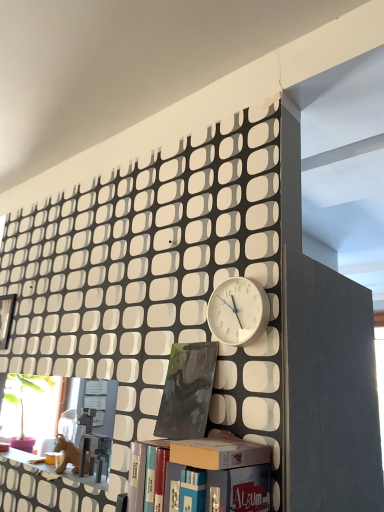
What do you see at coordinates (219, 452) in the screenshot?
I see `matte cardboard box at center` at bounding box center [219, 452].

Measure the distance between hardcover book at center, the first book viewed from the front, and camera.

The distance of hardcover book at center, the first book viewed from the front, from camera is 36.34 inches.

Find the location of a particular element. The image size is (384, 512). white matte clock at center is located at coordinates (238, 312).

Locate an element on the screen. bookcase on the left of the dark green matte painting at center, the first book in the back-to-front sequence is located at coordinates (156, 281).

From a real-world perspective, is dark green matte painting at center, the first book in the back-to-front sequence, above or below matte black bookcase at lower center?

From a real-world perspective, dark green matte painting at center, the first book in the back-to-front sequence, is physically below matte black bookcase at lower center.

Considering the sizes of objects dark green matte painting at center, the first book in the back-to-front sequence, and matte black bookcase at lower center in the image provided, who is taller, dark green matte painting at center, the first book in the back-to-front sequence, or matte black bookcase at lower center?

With more height is matte black bookcase at lower center.

Is point (197, 393) farther from viewer compared to point (263, 337)?

Yes, it is.

Between hardcover book at center, the first book viewed from the front, and white matte clock at center, which one has larger width?

Wider between the two is hardcover book at center, the first book viewed from the front.

Would you say hardcover book at center, the first book viewed from the front, is inside or outside white matte clock at center?

hardcover book at center, the first book viewed from the front, is not inside white matte clock at center, it's outside.

Is hardcover book at center, the 2th book when ordered from back to front, far from white matte clock at center?

No, hardcover book at center, the 2th book when ordered from back to front, is in close proximity to white matte clock at center.

Between hardcover book at center, the first book viewed from the front, and white matte clock at center, which one has smaller size?

Smaller between the two is white matte clock at center.

Consider the image. Is matte plastic shelf at lower left turned away from white matte clock at center?

matte plastic shelf at lower left does not have its back to white matte clock at center.

Can you confirm if matte plastic shelf at lower left is positioned to the right of white matte clock at center?

In fact, matte plastic shelf at lower left is to the left of white matte clock at center.

From the image's perspective, relative to white matte clock at center, is matte plastic shelf at lower left above or below?

matte plastic shelf at lower left is situated lower than white matte clock at center in the image.

Considering the relative sizes of matte plastic shelf at lower left and white matte clock at center in the image provided, is matte plastic shelf at lower left smaller than white matte clock at center?

No, matte plastic shelf at lower left is not smaller than white matte clock at center.

This screenshot has width=384, height=512. I want to click on bookcase behind the hardcover book at center, the 2th book when ordered from back to front, so click(156, 281).

Is hardcover book at center, the first book viewed from the front, next to matte black bookcase at lower center and touching it?

No, hardcover book at center, the first book viewed from the front, is not in contact with matte black bookcase at lower center.

Does hardcover book at center, the 2th book when ordered from back to front, turn towards matte black bookcase at lower center?

No.

Can you tell me how much hardcover book at center, the 2th book when ordered from back to front, and matte black bookcase at lower center differ in facing direction?

180 degrees.

Between dark green matte painting at center, the 2th book positioned from the front, and white matte clock at center, which one has larger size?

With larger size is white matte clock at center.

From the image's perspective, between dark green matte painting at center, the first book in the back-to-front sequence, and white matte clock at center, which one is located above?

white matte clock at center appears higher in the image.

From a real-world perspective, is dark green matte painting at center, the 2th book positioned from the front, beneath white matte clock at center?

Yes, from a real-world perspective, dark green matte painting at center, the 2th book positioned from the front, is beneath white matte clock at center.

In the image, is dark green matte painting at center, the first book in the back-to-front sequence, positioned in front of or behind white matte clock at center?

dark green matte painting at center, the first book in the back-to-front sequence, is positioned farther from the viewer than white matte clock at center.

From the image's perspective, is matte cardboard box at center located beneath matte black bookcase at lower center?

Indeed, from the image's perspective, matte cardboard box at center is shown beneath matte black bookcase at lower center.

Is matte cardboard box at center oriented away from matte black bookcase at lower center?

Yes, matte black bookcase at lower center is at the back of matte cardboard box at center.

Which point is more forward, (x=232, y=443) or (x=216, y=138)?

The point (x=232, y=443) is in front.

From a real-world perspective, which is physically below, matte cardboard box at center or matte black bookcase at lower center?

From a 3D spatial view, matte cardboard box at center is below.

Which object is wider, hardcover book at center, the 2th book when ordered from back to front, or matte cardboard box at center?

Wider between the two is matte cardboard box at center.

Is hardcover book at center, the first book viewed from the front, aimed at matte cardboard box at center?

No, hardcover book at center, the first book viewed from the front, is not aimed at matte cardboard box at center.

Is hardcover book at center, the 2th book when ordered from back to front, not close to matte cardboard box at center?

hardcover book at center, the 2th book when ordered from back to front, is actually quite close to matte cardboard box at center.

Is hardcover book at center, the 2th book when ordered from back to front, in front of or behind matte cardboard box at center in the image?

Clearly, hardcover book at center, the 2th book when ordered from back to front, is in front of matte cardboard box at center.

Find the location of a particular element. bookcase located in front of the dark green matte painting at center, the 2th book positioned from the front is located at coordinates (156, 281).

You are a GUI agent. You are given a task and a screenshot of the screen. Output one action in this format:
    pyautogui.click(x=<x>, y=<y>)
    Task: Click on the clock above the hardcover book at center, the first book viewed from the front (from the image's perspective)
    The height and width of the screenshot is (512, 384).
    Given the screenshot: What is the action you would take?
    pyautogui.click(x=238, y=312)

Based on their spatial positions, is matte cardboard box at center or white matte clock at center further from dark green matte painting at center, the 2th book positioned from the front?

Based on the image, matte cardboard box at center appears to be further to dark green matte painting at center, the 2th book positioned from the front.

Which object lies nearer to the anchor point matte black bookcase at lower center, matte plastic shelf at lower left or matte cardboard box at center?

Among the two, matte plastic shelf at lower left is located nearer to matte black bookcase at lower center.

Looking at the image, which one is located closer to hardcover book at center, the 2th book when ordered from back to front, matte plastic shelf at lower left or white matte clock at center?

white matte clock at center is positioned closer to the anchor hardcover book at center, the 2th book when ordered from back to front.

From the picture: Based on their spatial positions, is hardcover book at center, the first book viewed from the front, or matte cardboard box at center closer to matte plastic shelf at lower left?

hardcover book at center, the first book viewed from the front, is closer to matte plastic shelf at lower left.

From the image, which object appears to be farther from dark green matte painting at center, the first book in the back-to-front sequence, matte black bookcase at lower center or matte plastic shelf at lower left?

matte plastic shelf at lower left.

From the picture: Which object lies further to the anchor point white matte clock at center, hardcover book at center, the 2th book when ordered from back to front, or dark green matte painting at center, the first book in the back-to-front sequence?

hardcover book at center, the 2th book when ordered from back to front, lies further to white matte clock at center than the other object.

From the image, which object appears to be nearer to matte black bookcase at lower center, matte plastic shelf at lower left or hardcover book at center, the first book viewed from the front?

hardcover book at center, the first book viewed from the front, lies closer to matte black bookcase at lower center than the other object.

When comparing their distances from hardcover book at center, the first book viewed from the front, does matte plastic shelf at lower left or matte black bookcase at lower center seem closer?

matte black bookcase at lower center lies closer to hardcover book at center, the first book viewed from the front, than the other object.

Locate an element on the screen. The width and height of the screenshot is (384, 512). book situated between matte plastic shelf at lower left and hardcover book at center, the first book viewed from the front, from left to right is located at coordinates (187, 391).

You are a GUI agent. You are given a task and a screenshot of the screen. Output one action in this format:
    pyautogui.click(x=<x>, y=<y>)
    Task: Click on the book located between matte black bookcase at lower center and hardcover book at center, the 2th book when ordered from back to front, in the left-right direction
    
    Given the screenshot: What is the action you would take?
    pyautogui.click(x=187, y=391)

This screenshot has width=384, height=512. I want to click on box positioned between hardcover book at center, the 2th book when ordered from back to front, and dark green matte painting at center, the 2th book positioned from the front, from near to far, so click(x=219, y=452).

Where is `bookcase between matte plastic shelf at lower left and hardcover book at center, the first book viewed from the front, in the horizontal direction`? Image resolution: width=384 pixels, height=512 pixels. bookcase between matte plastic shelf at lower left and hardcover book at center, the first book viewed from the front, in the horizontal direction is located at coordinates (156, 281).